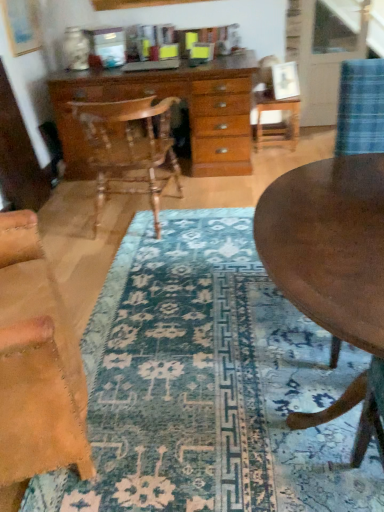
Question: Would you say wooden polished chair at center, placed as the second chair when sorted from front to back, is to the left or to the right of wooden round table at center in the picture?

Choices:
 (A) left
 (B) right

Answer: (A)

Question: Considering the positions of wooden polished chair at center, placed as the 2th chair when sorted from bottom to top, and wooden round table at center in the image, is wooden polished chair at center, placed as the 2th chair when sorted from bottom to top, taller or shorter than wooden round table at center?

Choices:
 (A) short
 (B) tall

Answer: (B)

Question: Estimate the real-world distances between objects in this image. Which object is farther from the wooden round table at center?

Choices:
 (A) wooden side table at center
 (B) wooden polished chair at center, the first chair viewed from the back
 (C) wooden chest of drawers at center
 (D) blue patterned rug at center
 (E) leather at left, which ranks as the first chair in bottom-to-top order

Answer: (A)

Question: Which object is the closest to the wooden chest of drawers at center?

Choices:
 (A) wooden polished chair at center, the first chair viewed from the back
 (B) leather at left, the first chair positioned from the front
 (C) wooden side table at center
 (D) wooden round table at center
 (E) blue patterned rug at center

Answer: (A)